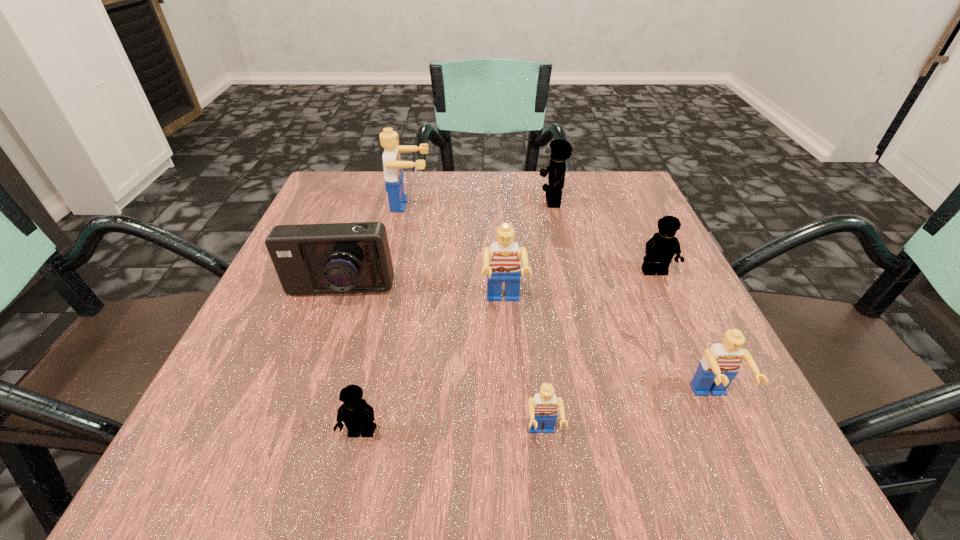
Locate an element on the screen. free space located 0.060m on the front-facing side of the rightmost yellow Lego is located at coordinates (669, 303).

Where is `free space located on the face of the rightmost blue Lego`? The height and width of the screenshot is (540, 960). free space located on the face of the rightmost blue Lego is located at coordinates (744, 470).

In order to click on object at the left edge in this screenshot , I will do `click(334, 258)`.

Find the location of a particular element. object that is at the near right corner is located at coordinates (716, 370).

Locate an element on the screen. This screenshot has width=960, height=540. free location at the far edge is located at coordinates (414, 201).

Where is `blank area at the near edge`? blank area at the near edge is located at coordinates (541, 429).

Identify the location of vacant area at the left edge. (265, 375).

Identify the location of free spot at the right edge of the desktop. (641, 322).

The image size is (960, 540). I want to click on vacant space at the far left corner of the desktop, so click(335, 174).

This screenshot has height=540, width=960. I want to click on vacant area at the far right corner, so (620, 188).